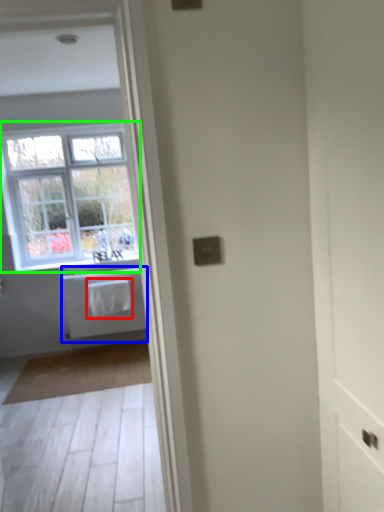
Question: Which is farther away from laundry (highlighted by a red box)? bath (highlighted by a blue box) or window (highlighted by a green box)?

Choices:
 (A) bath
 (B) window

Answer: (B)